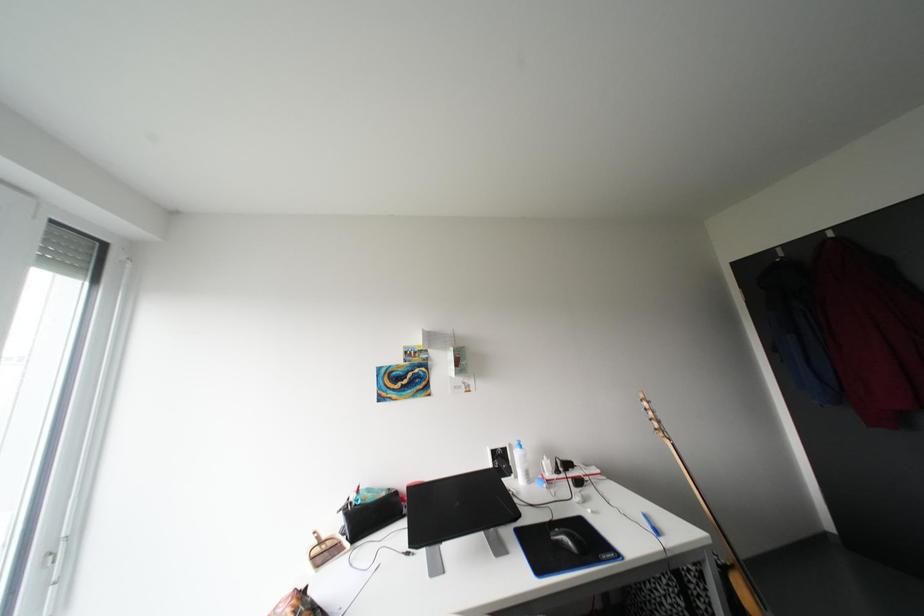
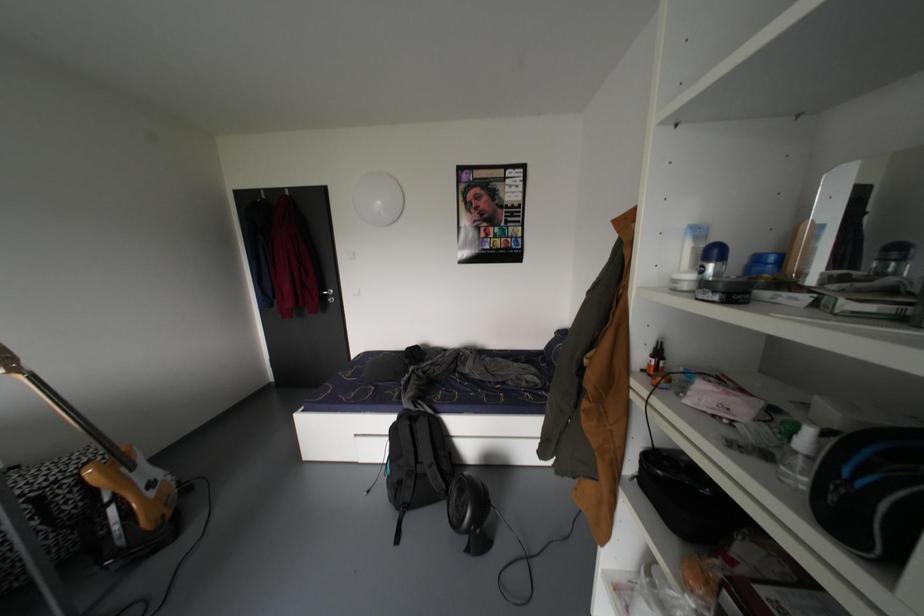
Question: Based on the continuous images, in which direction is the camera rotating? Reply with the corresponding letter.

Choices:
 (A) Left
 (B) Right
 (C) Up
 (D) Down

Answer: (B)